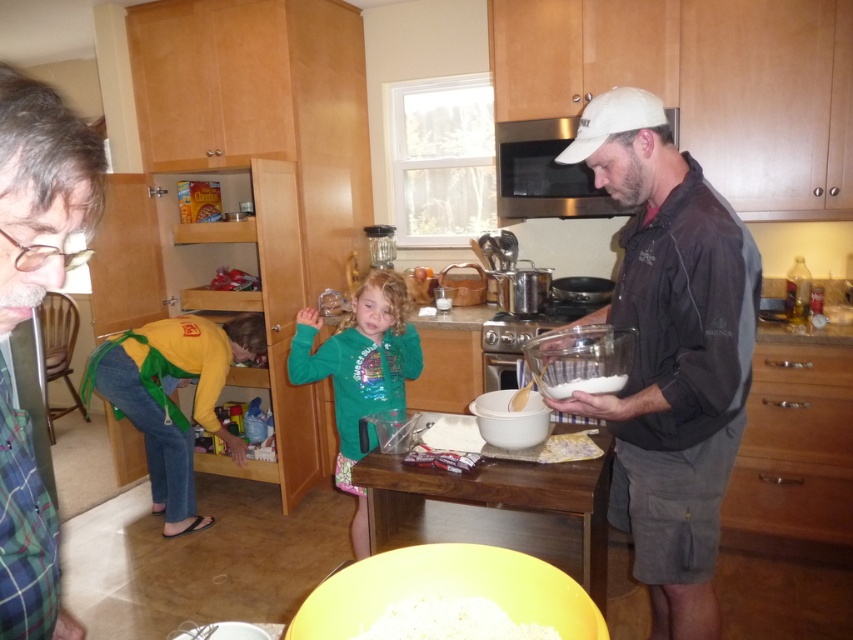
Question: Can you confirm if matte black jacket at right is wider than white fluffy rice at center?

Choices:
 (A) no
 (B) yes

Answer: (B)

Question: Is matte black jacket at right bigger than green matte shirt at center?

Choices:
 (A) yes
 (B) no

Answer: (B)

Question: Which of these objects is positioned closest to the yellow crumbly dough at center?

Choices:
 (A) matte black jacket at right
 (B) white fluffy rice at center
 (C) green matte shirt at center

Answer: (A)

Question: Is matte black jacket at right to the right of white matte bowl at center from the viewer's perspective?

Choices:
 (A) yes
 (B) no

Answer: (A)

Question: Estimate the real-world distances between objects in this image. Which object is closer to the green matte shirt at center?

Choices:
 (A) white matte mixing bowl at center
 (B) green plaid shirt at left

Answer: (A)

Question: Which of these objects is positioned farthest from the yellow matte bowl at center?

Choices:
 (A) green plaid shirt at left
 (B) white matte bowl at center
 (C) green matte shirt at center

Answer: (C)